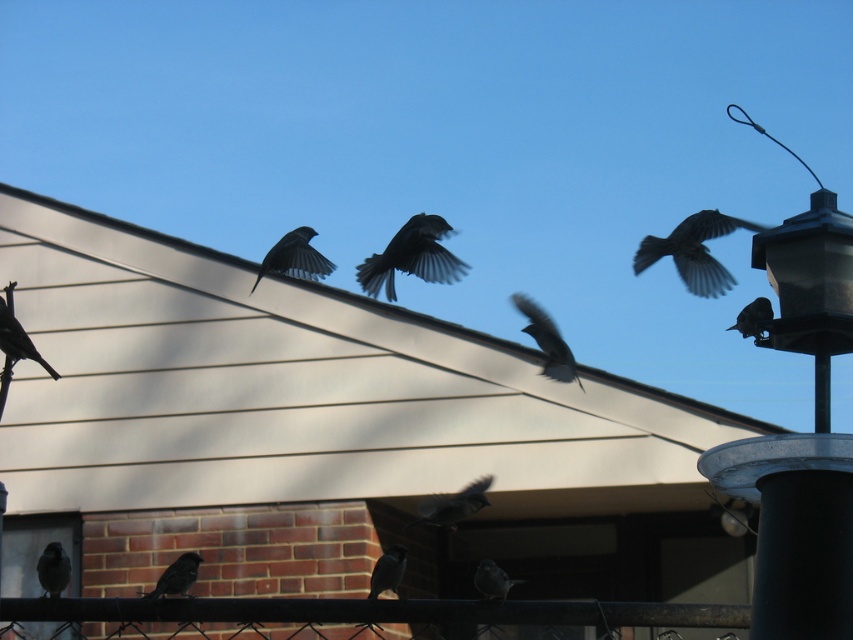
Question: From the image, what is the correct spatial relationship of silvery gray bird at center in relation to silvery gray feathers at center?

Choices:
 (A) left
 (B) right

Answer: (B)

Question: Which point is closer to the camera?

Choices:
 (A) (173, 586)
 (B) (67, 557)
 (C) (483, 580)
 (D) (758, 305)

Answer: (D)

Question: Which point is farther from the camera taking this photo?

Choices:
 (A) (397, 230)
 (B) (44, 561)
 (C) (312, 236)

Answer: (A)

Question: Is dark gray feathers at upper center smaller than silvery gray feathers at center?

Choices:
 (A) yes
 (B) no

Answer: (B)

Question: Which point is farther from the camera taking this photo?

Choices:
 (A) (439, 506)
 (B) (488, 588)
 (C) (827, 262)
 (D) (392, 579)

Answer: (A)

Question: Is silvery gray feathers at center wider than brown matte bird at lower left?

Choices:
 (A) yes
 (B) no

Answer: (A)